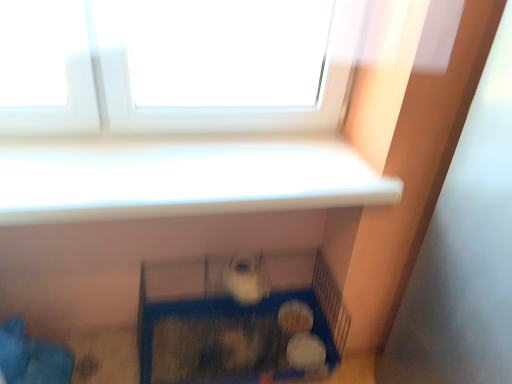
Question: Considering the positions of white fluffy ball at lower center, which ranks as the second animal in top-to-bottom order, and white fluffy ball at lower center, marked as the 2th animal in a back-to-front arrangement, in the image, is white fluffy ball at lower center, which ranks as the second animal in top-to-bottom order, bigger or smaller than white fluffy ball at lower center, marked as the 2th animal in a back-to-front arrangement,?

Choices:
 (A) big
 (B) small

Answer: (A)

Question: Is point (285, 309) closer or farther from the camera than point (321, 362)?

Choices:
 (A) farther
 (B) closer

Answer: (A)

Question: Estimate the real-world distances between objects in this image. Which object is closer to the white fluffy ball at lower center, which appears as the 2th animal when ordered from the bottom?

Choices:
 (A) blue plastic cage at lower center
 (B) white fur at center, positioned as the 3th animal in bottom-to-top order
 (C) white fluffy ball at lower center, marked as the 2th animal in a back-to-front arrangement

Answer: (C)

Question: Which is nearer to the white fluffy ball at lower center, which is counted as the 3th animal, starting from the front?

Choices:
 (A) blue plastic cage at lower center
 (B) white fluffy ball at lower center, the third animal in the top-to-bottom sequence
 (C) white fur at center, placed as the 1th animal when sorted from front to back

Answer: (B)